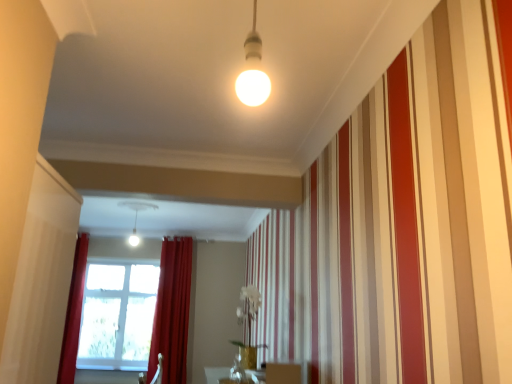
Question: Does matte gold vase at center have a lesser height compared to velvet red curtain at center, arranged as the second curtain when viewed from the left?

Choices:
 (A) no
 (B) yes

Answer: (B)

Question: Is the surface of matte gold vase at center in direct contact with velvet red curtain at center, placed as the first curtain when sorted from right to left?

Choices:
 (A) yes
 (B) no

Answer: (B)

Question: From a real-world perspective, is matte gold vase at center positioned over velvet red curtain at center, placed as the first curtain when sorted from right to left, based on gravity?

Choices:
 (A) yes
 (B) no

Answer: (B)

Question: Does matte gold vase at center appear on the left side of velvet red curtain at center, placed as the first curtain when sorted from right to left?

Choices:
 (A) no
 (B) yes

Answer: (A)

Question: Can you confirm if matte gold vase at center is taller than velvet red curtain at center, placed as the first curtain when sorted from right to left?

Choices:
 (A) no
 (B) yes

Answer: (A)

Question: Relative to velvet red curtain at left, positioned as the second curtain in right-to-left order, is velvet red curtain at center, placed as the first curtain when sorted from right to left, in front or behind?

Choices:
 (A) behind
 (B) front

Answer: (A)

Question: From the image's perspective, is velvet red curtain at center, placed as the first curtain when sorted from right to left, above or below velvet red curtain at left, the first curtain when ordered from left to right?

Choices:
 (A) above
 (B) below

Answer: (B)

Question: Considering the positions of velvet red curtain at center, arranged as the second curtain when viewed from the left, and velvet red curtain at left, the first curtain when ordered from left to right, in the image, is velvet red curtain at center, arranged as the second curtain when viewed from the left, wider or thinner than velvet red curtain at left, the first curtain when ordered from left to right,?

Choices:
 (A) thin
 (B) wide

Answer: (A)

Question: Is velvet red curtain at center, placed as the first curtain when sorted from right to left, taller or shorter than velvet red curtain at left, positioned as the second curtain in right-to-left order?

Choices:
 (A) tall
 (B) short

Answer: (B)

Question: Considering the positions of velvet red curtain at left, positioned as the second curtain in right-to-left order, and velvet red curtain at center, placed as the first curtain when sorted from right to left, in the image, is velvet red curtain at left, positioned as the second curtain in right-to-left order, taller or shorter than velvet red curtain at center, placed as the first curtain when sorted from right to left,?

Choices:
 (A) short
 (B) tall

Answer: (B)

Question: Considering the positions of velvet red curtain at left, the first curtain when ordered from left to right, and velvet red curtain at center, placed as the first curtain when sorted from right to left, in the image, is velvet red curtain at left, the first curtain when ordered from left to right, bigger or smaller than velvet red curtain at center, placed as the first curtain when sorted from right to left,?

Choices:
 (A) small
 (B) big

Answer: (A)

Question: From the image's perspective, is velvet red curtain at left, positioned as the second curtain in right-to-left order, above or below velvet red curtain at center, arranged as the second curtain when viewed from the left?

Choices:
 (A) below
 (B) above

Answer: (B)

Question: Considering the positions of velvet red curtain at left, positioned as the second curtain in right-to-left order, and velvet red curtain at center, placed as the first curtain when sorted from right to left, in the image, is velvet red curtain at left, positioned as the second curtain in right-to-left order, wider or thinner than velvet red curtain at center, placed as the first curtain when sorted from right to left,?

Choices:
 (A) thin
 (B) wide

Answer: (B)

Question: Considering the positions of transparent glass window screen at lower left and velvet red curtain at center, arranged as the second curtain when viewed from the left, in the image, is transparent glass window screen at lower left bigger or smaller than velvet red curtain at center, arranged as the second curtain when viewed from the left,?

Choices:
 (A) small
 (B) big

Answer: (A)

Question: From the image's perspective, is transparent glass window screen at lower left positioned above or below velvet red curtain at center, placed as the first curtain when sorted from right to left?

Choices:
 (A) below
 (B) above

Answer: (A)